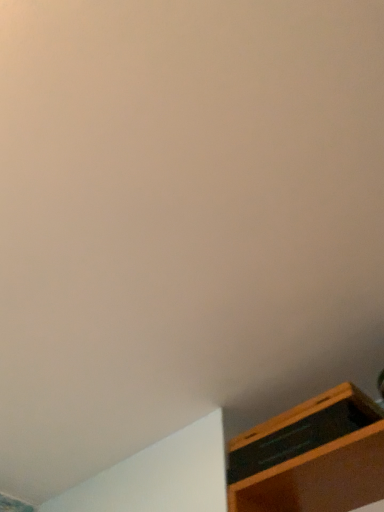
This screenshot has width=384, height=512. What do you see at coordinates (311, 457) in the screenshot?
I see `wooden shelf at lower right` at bounding box center [311, 457].

Image resolution: width=384 pixels, height=512 pixels. Identify the location of wooden shelf at lower right. (311, 457).

Where is `wooden shelf at lower right`? The height and width of the screenshot is (512, 384). wooden shelf at lower right is located at coordinates (311, 457).